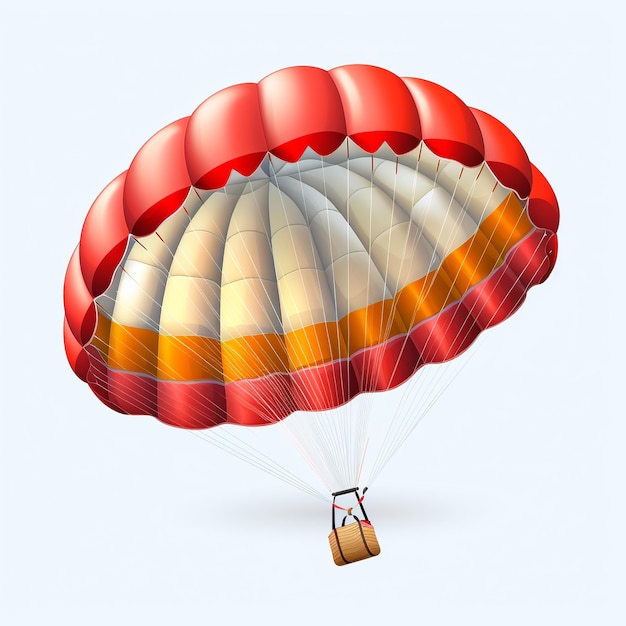
In order to click on cable in this screenshot , I will do (411, 392).